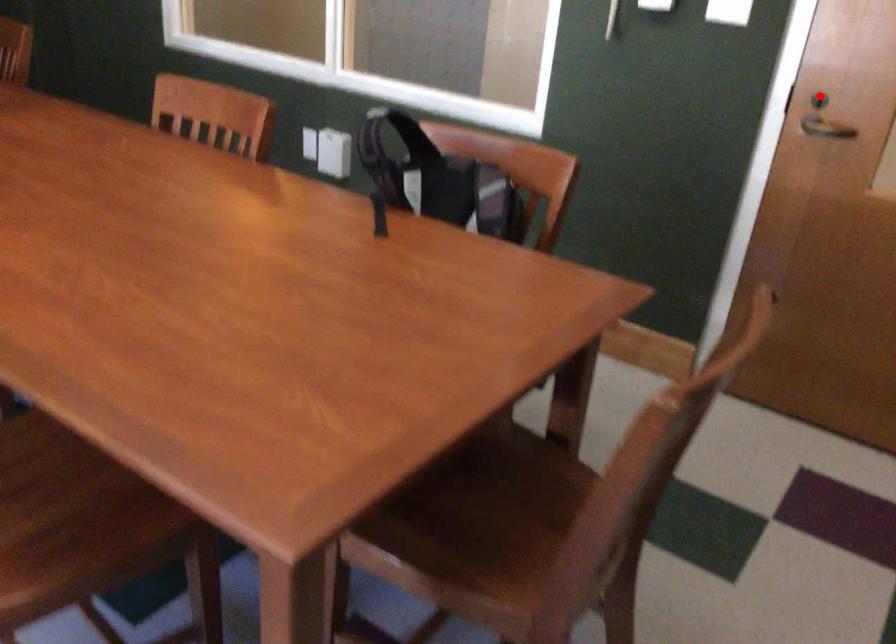
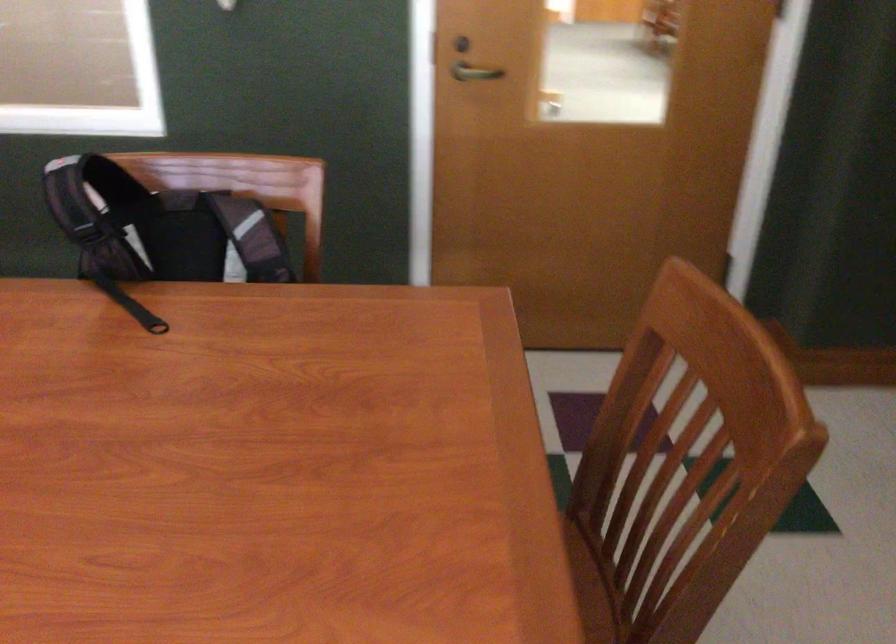
The point at the highlighted location is marked in the first image. Where is the corresponding point in the second image?

(460, 44)